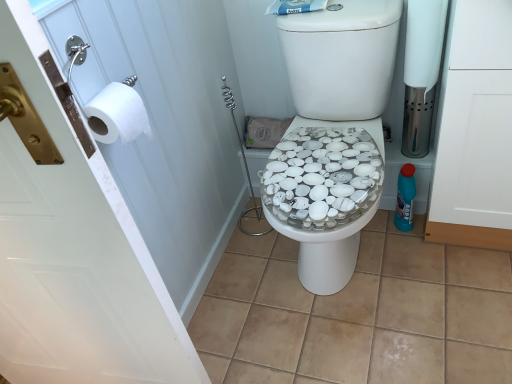
Question: Is white matte toilet paper at right, placed as the 2th toilet paper when sorted from front to back, surrounding white matte toilet paper at left, acting as the 1th toilet paper starting from the bottom?

Choices:
 (A) yes
 (B) no

Answer: (B)

Question: From the image's perspective, is white matte toilet paper at right, placed as the 2th toilet paper when sorted from front to back, under white matte toilet paper at left, the second toilet paper in the top-to-bottom sequence?

Choices:
 (A) yes
 (B) no

Answer: (B)

Question: Would you say white matte toilet paper at right, acting as the 1th toilet paper starting from the top, is a long distance from white matte toilet paper at left, the first toilet paper when ordered from front to back?

Choices:
 (A) no
 (B) yes

Answer: (A)

Question: Considering the relative sizes of white matte toilet paper at right, acting as the 1th toilet paper starting from the top, and white matte toilet paper at left, placed as the second toilet paper when sorted from back to front, in the image provided, is white matte toilet paper at right, acting as the 1th toilet paper starting from the top, shorter than white matte toilet paper at left, placed as the second toilet paper when sorted from back to front,?

Choices:
 (A) yes
 (B) no

Answer: (B)

Question: Is white matte toilet paper at right, acting as the 1th toilet paper starting from the top, next to white matte toilet paper at left, the first toilet paper when ordered from front to back, and touching it?

Choices:
 (A) no
 (B) yes

Answer: (A)

Question: Does white matte toilet paper at right, the second toilet paper positioned from the bottom, have a lesser width compared to white matte toilet paper at left, acting as the 1th toilet paper starting from the bottom?

Choices:
 (A) no
 (B) yes

Answer: (A)

Question: Is white matte cabinet at right, which appears as the 1th screen door when viewed from the right, further to the viewer compared to white paper at left, marked as the first screen door in a left-to-right arrangement?

Choices:
 (A) yes
 (B) no

Answer: (A)

Question: From the image's perspective, is white matte cabinet at right, marked as the 2th screen door in a left-to-right arrangement, under white paper at left, which appears as the second screen door when viewed from the right?

Choices:
 (A) no
 (B) yes

Answer: (A)

Question: Considering the relative sizes of white matte cabinet at right, which appears as the 1th screen door when viewed from the right, and white paper at left, which appears as the second screen door when viewed from the right, in the image provided, is white matte cabinet at right, which appears as the 1th screen door when viewed from the right, shorter than white paper at left, which appears as the second screen door when viewed from the right,?

Choices:
 (A) no
 (B) yes

Answer: (B)

Question: Is white paper at left, which appears as the second screen door when viewed from the right, completely or partially inside white matte cabinet at right, marked as the 2th screen door in a left-to-right arrangement?

Choices:
 (A) no
 (B) yes

Answer: (A)

Question: Does white matte cabinet at right, which appears as the 1th screen door when viewed from the right, appear on the right side of white paper at left, which appears as the second screen door when viewed from the right?

Choices:
 (A) no
 (B) yes

Answer: (B)

Question: Is white matte cabinet at right, which appears as the 1th screen door when viewed from the right, facing towards white paper at left, marked as the first screen door in a left-to-right arrangement?

Choices:
 (A) yes
 (B) no

Answer: (B)

Question: Is blue plastic bottle at right shorter than white matte toilet paper at left, the first toilet paper when ordered from front to back?

Choices:
 (A) yes
 (B) no

Answer: (B)